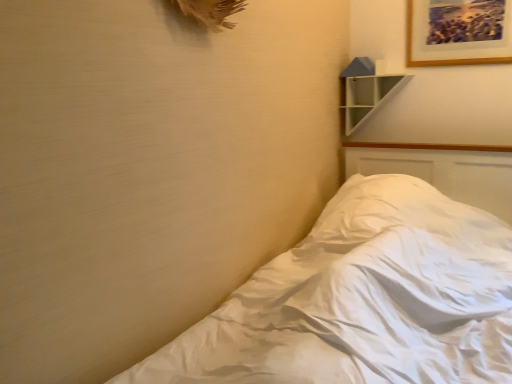
Question: Can you confirm if white glossy shelf at upper right is wider than wooden picture frame at upper right?

Choices:
 (A) no
 (B) yes

Answer: (B)

Question: Can you confirm if white glossy shelf at upper right is positioned to the left of wooden picture frame at upper right?

Choices:
 (A) no
 (B) yes

Answer: (B)

Question: Is white glossy shelf at upper right positioned in front of wooden picture frame at upper right?

Choices:
 (A) no
 (B) yes

Answer: (A)

Question: Is white glossy shelf at upper right at the right side of wooden picture frame at upper right?

Choices:
 (A) no
 (B) yes

Answer: (A)

Question: Does white glossy shelf at upper right have a lesser height compared to wooden picture frame at upper right?

Choices:
 (A) yes
 (B) no

Answer: (B)

Question: In the image, is wooden picture frame at upper right positioned in front of or behind white soft bed at lower right?

Choices:
 (A) behind
 (B) front

Answer: (A)

Question: From a real-world perspective, relative to white soft bed at lower right, is wooden picture frame at upper right vertically above or below?

Choices:
 (A) below
 (B) above

Answer: (B)

Question: Would you say wooden picture frame at upper right is to the left or to the right of white soft bed at lower right in the picture?

Choices:
 (A) left
 (B) right

Answer: (B)

Question: From the image's perspective, relative to white soft bed at lower right, is wooden picture frame at upper right above or below?

Choices:
 (A) above
 (B) below

Answer: (A)

Question: In the image, is white soft bed at lower right positioned in front of or behind wooden picture frame at upper right?

Choices:
 (A) behind
 (B) front

Answer: (B)

Question: From the image's perspective, is white soft bed at lower right located above or below wooden picture frame at upper right?

Choices:
 (A) below
 (B) above

Answer: (A)

Question: Is point (241, 370) positioned closer to the camera than point (441, 49)?

Choices:
 (A) farther
 (B) closer

Answer: (B)

Question: From a real-world perspective, is white soft bed at lower right above or below wooden picture frame at upper right?

Choices:
 (A) above
 (B) below

Answer: (B)

Question: Is white glossy shelf at upper right wider or thinner than white soft bed at lower right?

Choices:
 (A) wide
 (B) thin

Answer: (B)

Question: Is white glossy shelf at upper right inside the boundaries of white soft bed at lower right, or outside?

Choices:
 (A) inside
 (B) outside

Answer: (B)